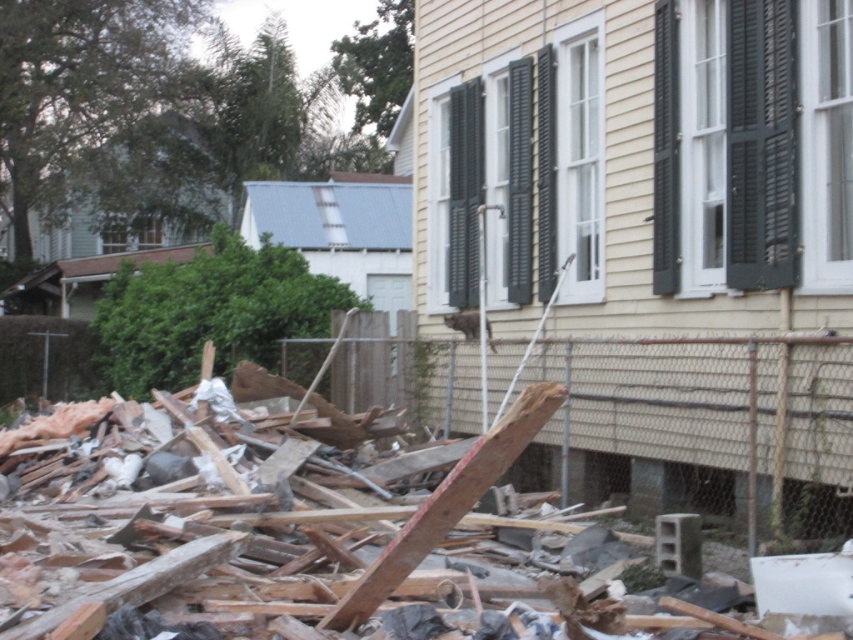
Question: Which point is closer to the camera?

Choices:
 (A) black matte shutters at center
 (B) rusty metal fence at lower center

Answer: (B)

Question: Which object is the closest to the black matte shutters at upper center?

Choices:
 (A) black matte shutters at upper right
 (B) black matte shutters at center
 (C) rusty metal fence at lower center

Answer: (B)

Question: Considering the real-world distances, which object is farthest from the black matte shutters at upper right?

Choices:
 (A) black matte shutters at upper center
 (B) rusty metal fence at lower center
 (C) black matte shutters at center

Answer: (C)

Question: Does black matte shutters at upper right lie in front of black matte shutters at upper center?

Choices:
 (A) no
 (B) yes

Answer: (B)

Question: Is rusty metal fence at lower center behind black matte shutters at upper right?

Choices:
 (A) no
 (B) yes

Answer: (B)

Question: Can you confirm if black matte shutters at center is positioned to the left of black matte shutters at upper center?

Choices:
 (A) yes
 (B) no

Answer: (A)